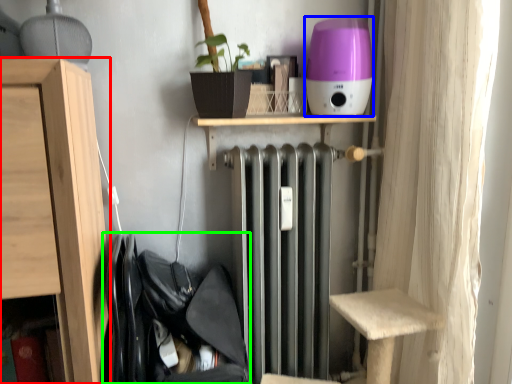
Question: Which object is positioned farthest from furniture (highlighted by a red box)? Select from appliance (highlighted by a blue box) and laundry (highlighted by a green box).

Choices:
 (A) appliance
 (B) laundry

Answer: (A)